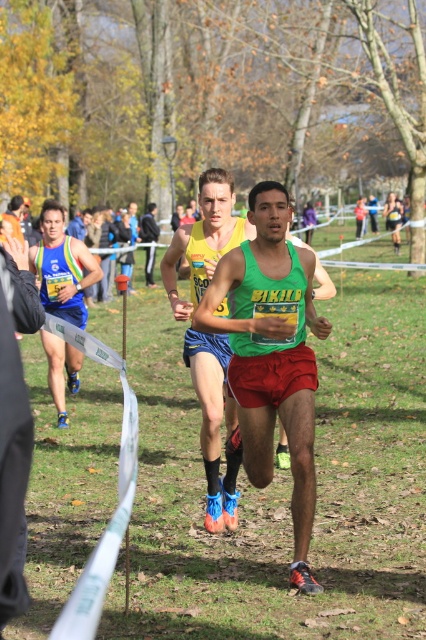
You are a race official trying to locate the runner wearing the green matte tank top at center for a post race interview. According to the coordinates provided, where exactly should you look to find this runner?

The green matte tank top at center is located at coordinates point (215, 424).

You are a photographer standing at the starting line of the cross country race. You want to capture a closeup shot of the green matte tank top at center. Your camera has a minimum focusing distance of 3 meters. Will you be able to take the photo without moving closer?

The green matte tank top at center is 5.08 meters away from the camera. Since the minimum focusing distance is 3 meters, the photographer can take the photo without moving closer because the subject is within the camera range.

You are a race official trying to ensure that all runners maintain a safe distance of at least 10 feet apart during the race. Looking at the green matte tank top at center and the matte blue shorts at left, are these two runners currently violating the distance requirement?

The green matte tank top at center and the matte blue shorts at left are 8.80 feet apart from each other, which is less than the required 10 feet. Therefore, these two runners are violating the distance requirement.